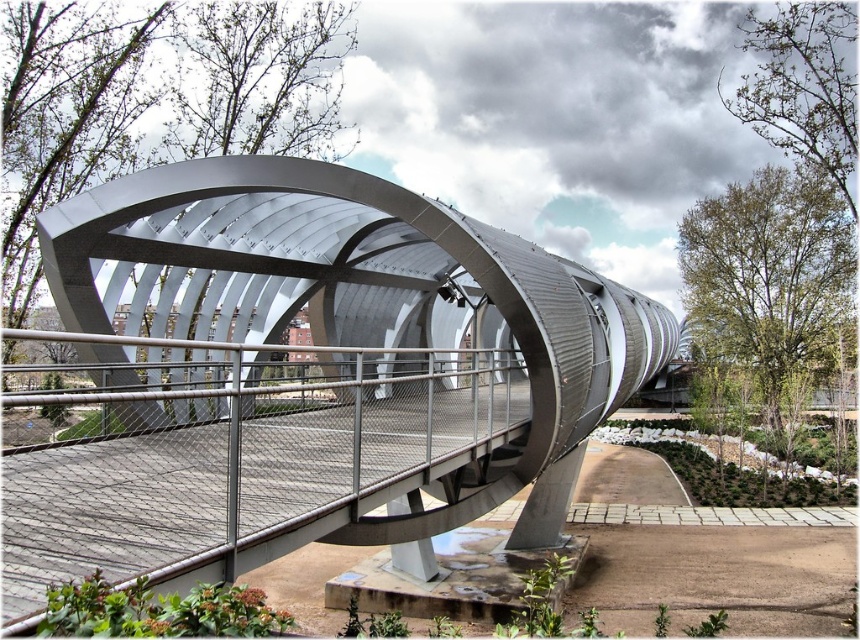
Measure the distance between polished steel bridge at center and metal mesh railing at center.

A distance of 30.79 inches exists between polished steel bridge at center and metal mesh railing at center.

Can you confirm if polished steel bridge at center is taller than metal mesh railing at center?

Yes.

Locate an element on the screen. This screenshot has width=860, height=640. polished steel bridge at center is located at coordinates (292, 380).